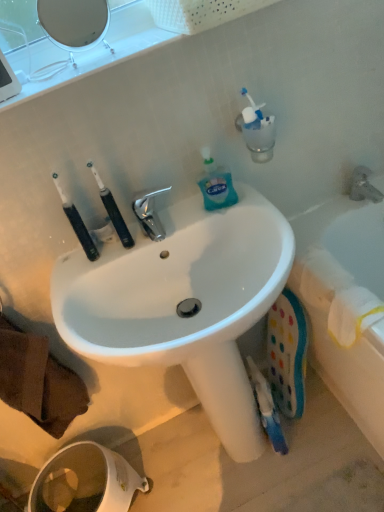
Question: Is black rubber toothbrush at left positioned behind white glossy toilet paper at lower left?

Choices:
 (A) yes
 (B) no

Answer: (B)

Question: Is black rubber toothbrush at left looking in the opposite direction of white glossy toilet paper at lower left?

Choices:
 (A) yes
 (B) no

Answer: (B)

Question: From a real-world perspective, is black rubber toothbrush at left physically above white glossy toilet paper at lower left?

Choices:
 (A) yes
 (B) no

Answer: (A)

Question: Is black rubber toothbrush at left in front of white glossy toilet paper at lower left?

Choices:
 (A) no
 (B) yes

Answer: (B)

Question: Are black rubber toothbrush at left and white glossy toilet paper at lower left far apart?

Choices:
 (A) no
 (B) yes

Answer: (A)

Question: In terms of height, does translucent plastic bottle at upper right look taller or shorter compared to white plastic bathtub at right?

Choices:
 (A) tall
 (B) short

Answer: (B)

Question: In the image, is translucent plastic bottle at upper right positioned in front of or behind white plastic bathtub at right?

Choices:
 (A) front
 (B) behind

Answer: (B)

Question: From a real-world perspective, is translucent plastic bottle at upper right physically located above or below white plastic bathtub at right?

Choices:
 (A) below
 (B) above

Answer: (B)

Question: In the image, is translucent plastic bottle at upper right on the left side or the right side of white plastic bathtub at right?

Choices:
 (A) left
 (B) right

Answer: (A)

Question: Considering the positions of translucent plastic bottle at upper right and white glossy sink at center in the image, is translucent plastic bottle at upper right taller or shorter than white glossy sink at center?

Choices:
 (A) short
 (B) tall

Answer: (A)

Question: Does point (208, 204) appear closer or farther from the camera than point (231, 290)?

Choices:
 (A) closer
 (B) farther

Answer: (B)

Question: In the image, is translucent plastic bottle at upper right on the left side or the right side of white glossy sink at center?

Choices:
 (A) right
 (B) left

Answer: (B)

Question: Do you think translucent plastic bottle at upper right is within white glossy sink at center, or outside of it?

Choices:
 (A) inside
 (B) outside

Answer: (B)

Question: Is white glossy mirror at upper left situated inside white glossy toilet paper at lower left or outside?

Choices:
 (A) outside
 (B) inside

Answer: (A)

Question: Considering the positions of white glossy mirror at upper left and white glossy toilet paper at lower left in the image, is white glossy mirror at upper left wider or thinner than white glossy toilet paper at lower left?

Choices:
 (A) wide
 (B) thin

Answer: (B)